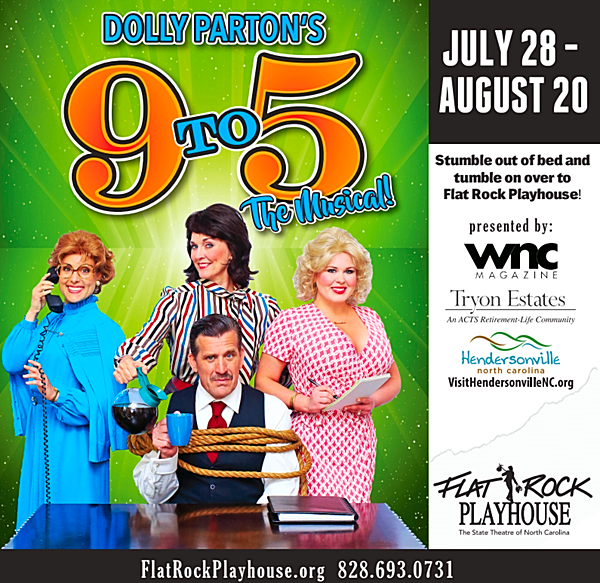
Identify the location of coffee pot to left of man. The height and width of the screenshot is (583, 600). (138, 417).